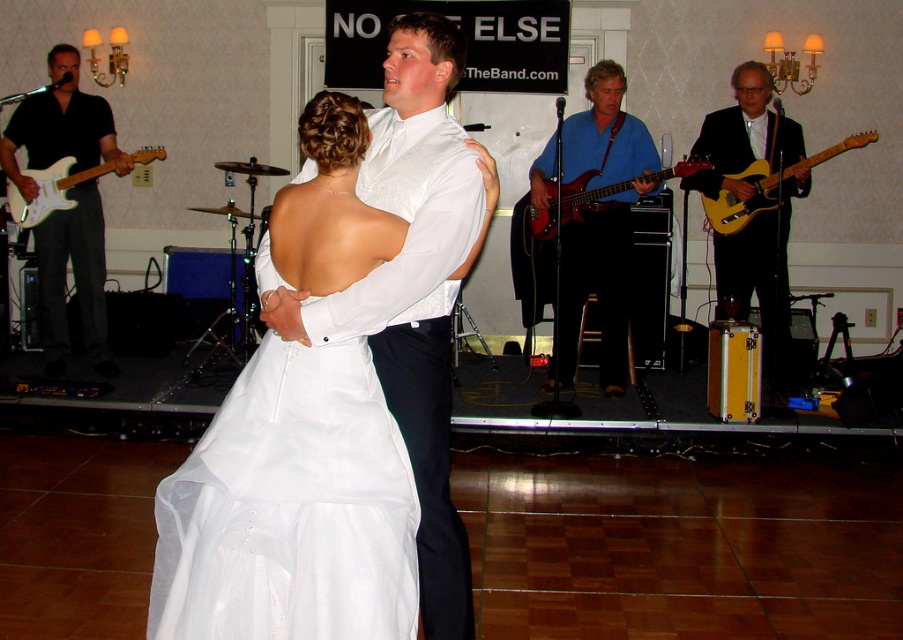
Question: Does black matte guitar at left appear on the left side of glossy wood bass guitar at center?

Choices:
 (A) yes
 (B) no

Answer: (A)

Question: Which object appears farthest from the camera in this image?

Choices:
 (A) blue fabric guitar at center
 (B) yellow wood electric guitar at right
 (C) black matte guitar at left

Answer: (C)

Question: Which point is closer to the camera taking this photo?

Choices:
 (A) (807, 160)
 (B) (291, 518)
 (C) (64, 349)
 (D) (59, 160)

Answer: (B)

Question: Does shiny gold guitar at right have a smaller size compared to glossy wood bass guitar at center?

Choices:
 (A) yes
 (B) no

Answer: (B)

Question: Which object appears closest to the camera in this image?

Choices:
 (A) blue fabric guitar at center
 (B) white glossy electric guitar at left
 (C) white satin dress at center
 (D) yellow wood electric guitar at right

Answer: (C)

Question: Can you confirm if white satin dress at center is bigger than glossy wood bass guitar at center?

Choices:
 (A) yes
 (B) no

Answer: (A)